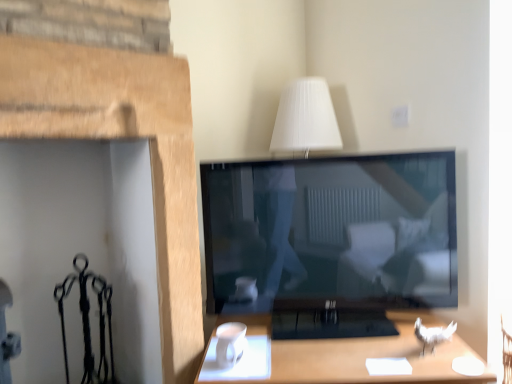
The width and height of the screenshot is (512, 384). What do you see at coordinates (365, 358) in the screenshot?
I see `wooden desk at lower right` at bounding box center [365, 358].

Find the location of a particular element. Image resolution: width=512 pixels, height=384 pixels. wooden desk at lower right is located at coordinates (365, 358).

Locate an element on the screen. The image size is (512, 384). wooden desk at lower right is located at coordinates (365, 358).